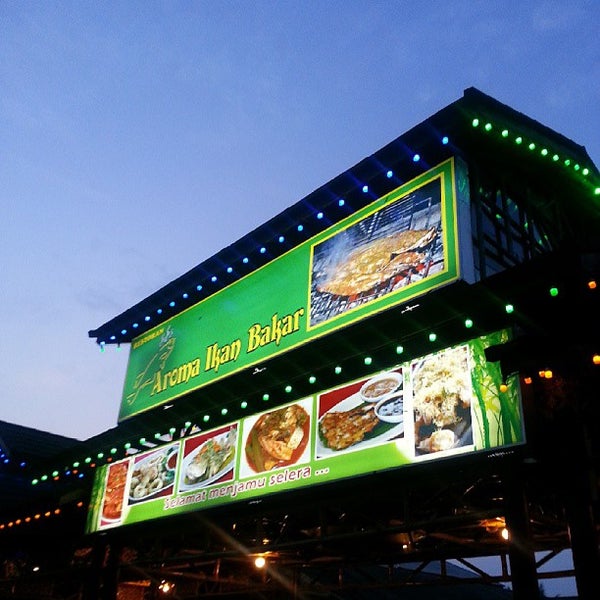
I want to click on ceiling, so click(x=367, y=505), click(x=50, y=518), click(x=538, y=205).